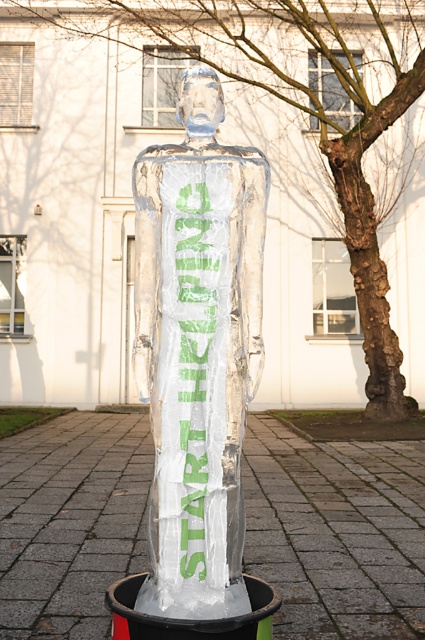
Is clear ice figure at center behind green translucent ice at center?

No, clear ice figure at center is closer to the viewer.

Based on the photo, is clear ice figure at center smaller than green translucent ice at center?

No, clear ice figure at center is not smaller than green translucent ice at center.

Where is `clear ice figure at center`? clear ice figure at center is located at coordinates (198, 349).

Which of these two, bark textured tree at center right or clear ice figure at center, stands taller?

Standing taller between the two is bark textured tree at center right.

Does bark textured tree at center right come in front of clear ice figure at center?

No, bark textured tree at center right is further to the viewer.

Locate an element on the screen. The image size is (425, 640). bark textured tree at center right is located at coordinates (221, 140).

Consider the image. Who is positioned more to the right, transparent ice sculpture at center or green translucent ice at center?

From the viewer's perspective, transparent ice sculpture at center appears more on the right side.

How distant is transparent ice sculpture at center from green translucent ice at center?

The distance of transparent ice sculpture at center from green translucent ice at center is 3.78 meters.

You are a GUI agent. You are given a task and a screenshot of the screen. Output one action in this format:
    pyautogui.click(x=<x>, y=<y>)
    Task: Click on the transparent ice sculpture at center
    The height and width of the screenshot is (640, 425).
    Given the screenshot: What is the action you would take?
    pyautogui.click(x=336, y=532)